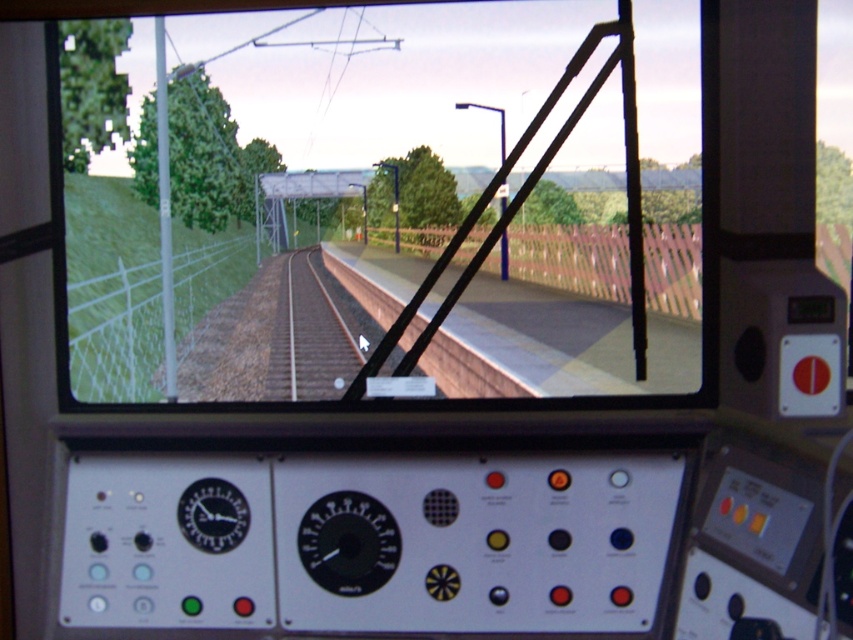
You are operating the train simulator and need to check both the clear glass train window at center and the black plastic gauge at center. Which object is positioned higher in your field of view?

The clear glass train window at center is located above the black plastic gauge at center, so it is positioned higher in your field of view.

You are an engineer in the train simulator. You notice two points on the screen, one at coordinates point (321,292) and another at point (389,552). Which point is closer to your viewpoint?

Point (321,292) is further to the viewer than point (389,552), so the point closer to your viewpoint is point (389,552).

You are an operator in the train simulator. You notice two points on the control panel labeled as point 1 at coordinates point 1 at coordinates point (463, 262) and point 2 at coordinates point (312, 326). Which point is closer to you?

Point (312, 326) is closer to you because it is less further to the camera than point (463, 262).